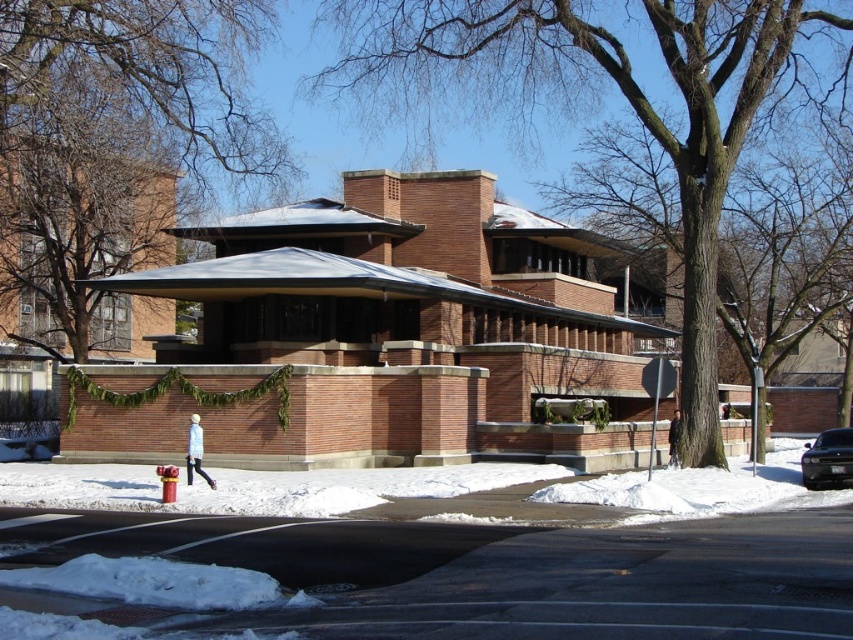
Is bare branches at upper center in front of shiny black sedan at lower right?

Yes.

You are a GUI agent. You are given a task and a screenshot of the screen. Output one action in this format:
    pyautogui.click(x=<x>, y=<y>)
    Task: Click on the bare branches at upper center
    This screenshot has height=640, width=853.
    Given the screenshot: What is the action you would take?
    pyautogui.click(x=114, y=132)

Locate an element on the screen. The height and width of the screenshot is (640, 853). bare branches at upper center is located at coordinates (114, 132).

At what (x,y) coordinates should I click in order to perform the action: click on bare branches at upper center. Please return your answer as a coordinate pair (x, y). The image size is (853, 640). Looking at the image, I should click on (114, 132).

Who is positioned more to the right, brown brick gazebo at center or shiny black sedan at lower right?

shiny black sedan at lower right is more to the right.

Between brown brick gazebo at center and shiny black sedan at lower right, which one is positioned lower?

Positioned lower is shiny black sedan at lower right.

Is point (445, 410) closer to camera compared to point (833, 467)?

No, it is not.

Identify the location of brown brick gazebo at center. This screenshot has height=640, width=853. (396, 320).

Does brown textured tree at center have a smaller size compared to shiny black sedan at lower right?

No, brown textured tree at center is not smaller than shiny black sedan at lower right.

Based on the photo, can you confirm if brown textured tree at center is positioned above shiny black sedan at lower right?

Correct, brown textured tree at center is located above shiny black sedan at lower right.

Is point (434, 10) more distant than point (807, 483)?

Yes, point (434, 10) is farther from viewer.

The height and width of the screenshot is (640, 853). Find the location of `brown textured tree at center`. brown textured tree at center is located at coordinates (595, 97).